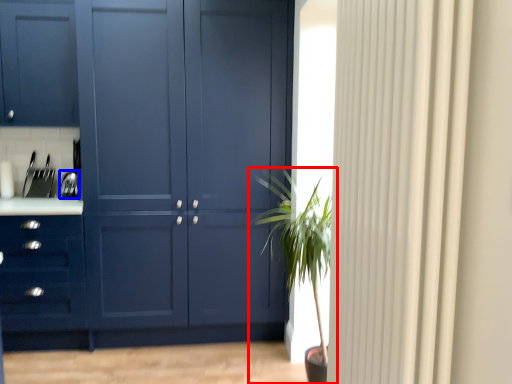
Question: Which point is closer to the camera, houseplant (highlighted by a red box) or appliance (highlighted by a blue box)?

Choices:
 (A) houseplant
 (B) appliance

Answer: (A)